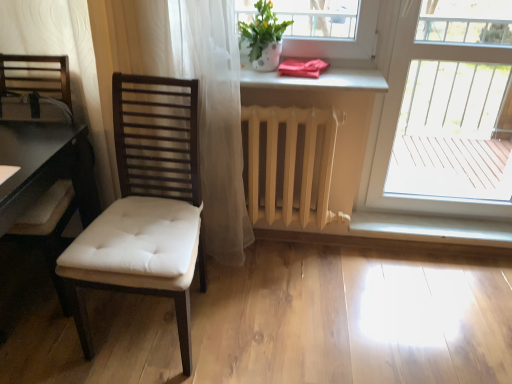
You are a GUI agent. You are given a task and a screenshot of the screen. Output one action in this format:
    pyautogui.click(x=<x>, y=<y>)
    Task: Click on the vacant area located to the right-hand side of matte white cushioned chair at left
    
    Given the screenshot: What is the action you would take?
    pyautogui.click(x=261, y=322)